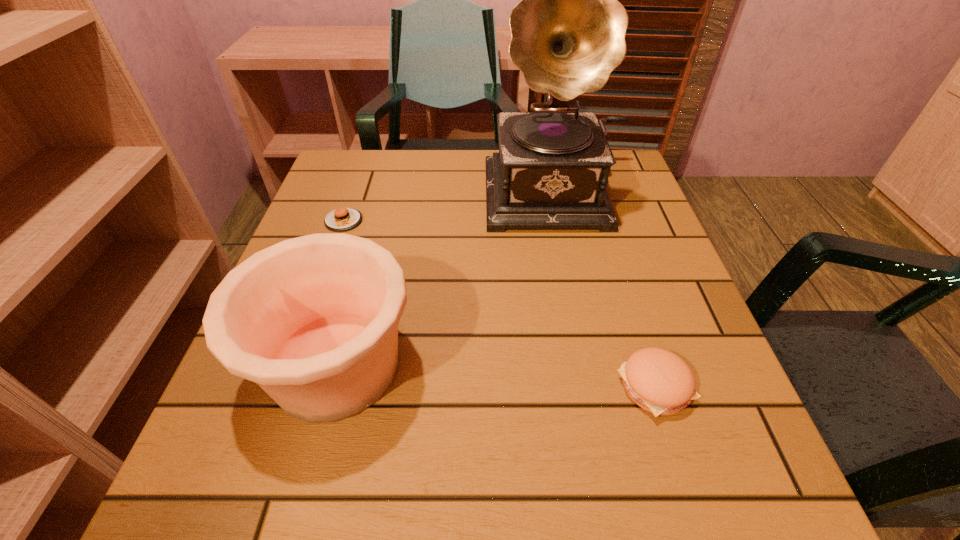
Where is `object that is the second closest to the record player`? object that is the second closest to the record player is located at coordinates (342, 219).

Select which object is the third closest to the pottery. Please provide its 2D coordinates. Your answer should be formatted as a tuple, i.e. [(x, y)], where the tuple contains the x and y coordinates of a point satisfying the conditions above.

[(659, 381)]

Identify the location of free space that satisfies the following two spatial constraints: 1. on the front side of the second shortest object; 2. on the right side of the left food. Image resolution: width=960 pixels, height=540 pixels. (285, 387).

The width and height of the screenshot is (960, 540). In order to click on free space that satisfies the following two spatial constraints: 1. on the horn of the second shortest object; 2. on the left side of the record player in this screenshot , I will do `click(602, 387)`.